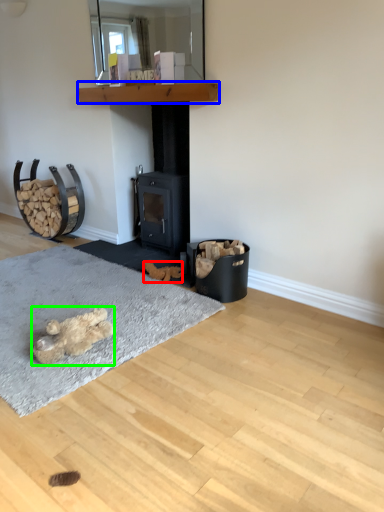
Question: Which object is the closest to the animal (highlighted by a red box)? Choose among these: shelf (highlighted by a blue box) or animal (highlighted by a green box).

Choices:
 (A) shelf
 (B) animal

Answer: (B)